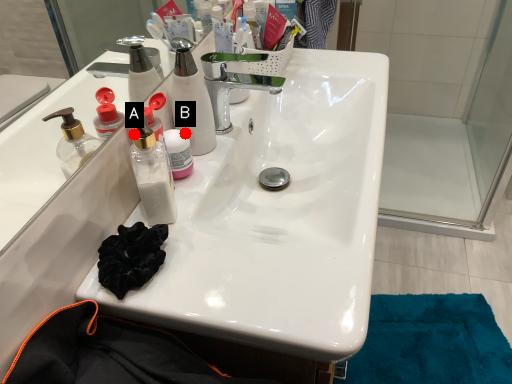
Question: Two points are circled on the image, labeled by A and B beside each circle. Which point is farther from the camera taking this photo?

Choices:
 (A) A is further
 (B) B is further

Answer: (B)